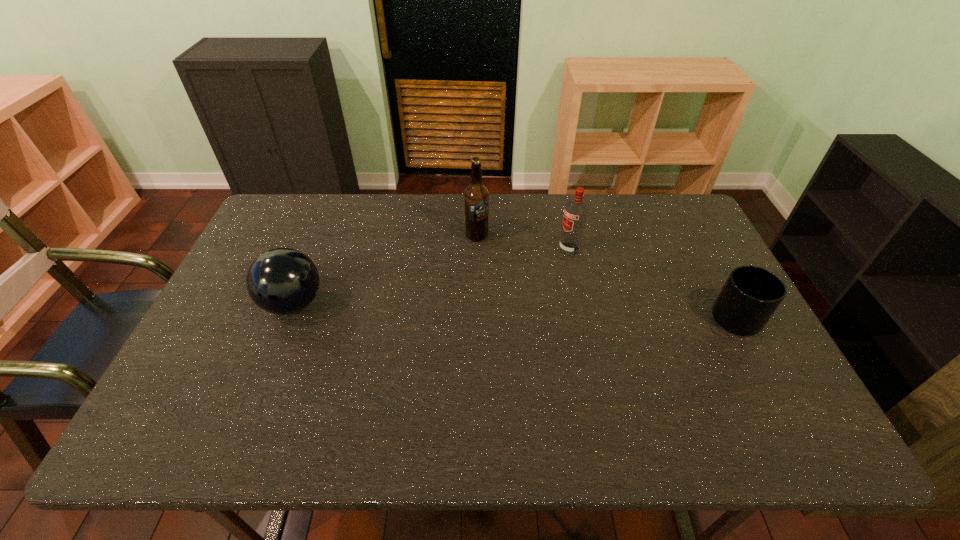
Locate an element on the screen. free space located on the front label of the second tallest object is located at coordinates (532, 269).

Where is `blank area located on the front label of the second tallest object`? This screenshot has width=960, height=540. blank area located on the front label of the second tallest object is located at coordinates (463, 306).

Identify the location of vacant space located 0.110m on the label of the beer bottle. (495, 264).

Where is `free point located on the label of the beer bottle`? free point located on the label of the beer bottle is located at coordinates (539, 329).

Find the location of a particular element. Image resolution: width=960 pixels, height=540 pixels. vacant area located on the label of the beer bottle is located at coordinates (519, 300).

This screenshot has width=960, height=540. I want to click on object that is at the far edge, so click(x=476, y=197).

What are the coordinates of `object at the left edge` in the screenshot? It's located at (282, 281).

At what (x,y) coordinates should I click in order to perform the action: click on object located in the right edge section of the desktop. Please return your answer as a coordinate pair (x, y). The image size is (960, 540). Looking at the image, I should click on (750, 296).

Image resolution: width=960 pixels, height=540 pixels. What are the coordinates of `vacant space at the far edge of the desktop` in the screenshot? It's located at (597, 228).

At what (x,y) coordinates should I click in order to perform the action: click on vacant space at the near edge. Please return your answer as a coordinate pair (x, y). Looking at the image, I should click on (478, 379).